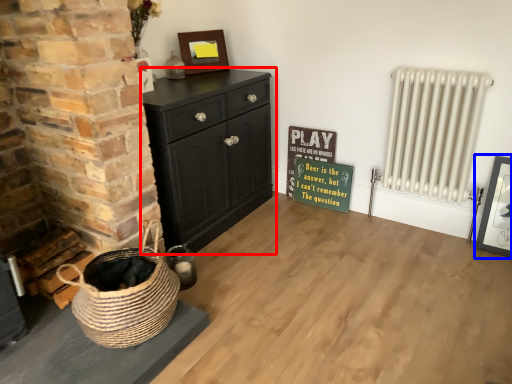
Question: Among these objects, which one is nearest to the camera, chest of drawers (highlighted by a red box) or picture frame (highlighted by a blue box)?

Choices:
 (A) chest of drawers
 (B) picture frame

Answer: (A)